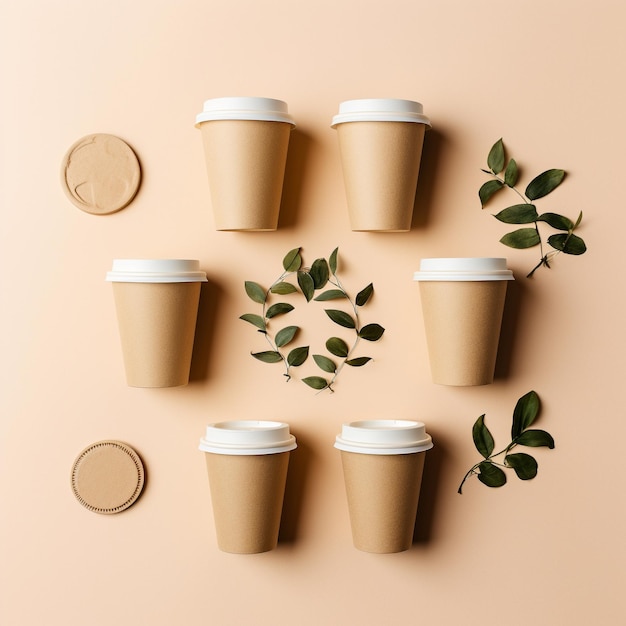
Where is `cups in a circle of 5 cups`? cups in a circle of 5 cups is located at coordinates (178, 319), (249, 473), (385, 451), (466, 312), (387, 167), (260, 186).